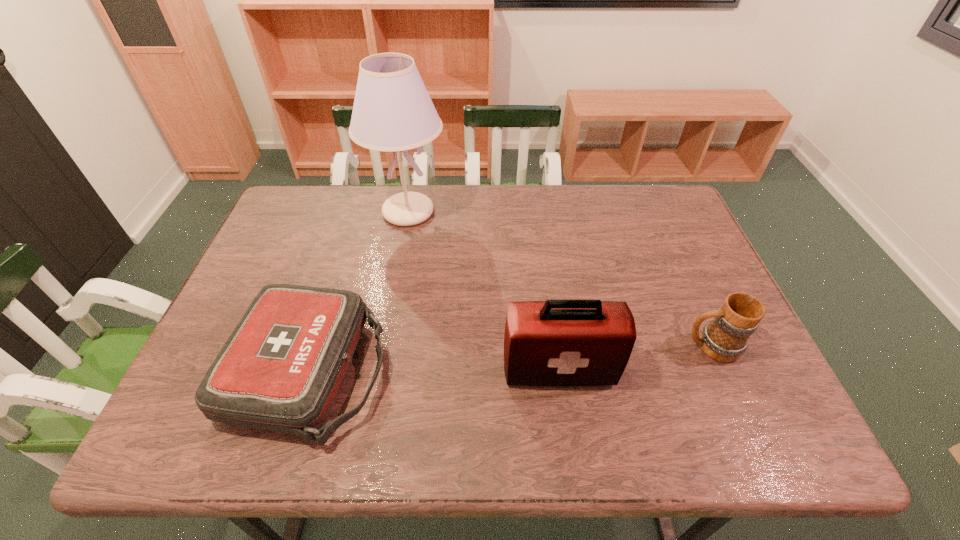
Find the location of a particular element. The height and width of the screenshot is (540, 960). the farthest object is located at coordinates coord(392,112).

At what (x,y) coordinates should I click in order to perform the action: click on the tallest object. Please return your answer as a coordinate pair (x, y). The image size is (960, 540). Looking at the image, I should click on (392, 112).

Locate an element on the screen. the taller first-aid kit is located at coordinates [556, 342].

Where is `the second object from right to left`? The width and height of the screenshot is (960, 540). the second object from right to left is located at coordinates (556, 342).

Where is `the third tallest object`? The image size is (960, 540). the third tallest object is located at coordinates (725, 338).

Where is `mug`? The image size is (960, 540). mug is located at coordinates (725, 338).

At what (x,y) coordinates should I click in order to perform the action: click on the shortest object. Please return your answer as a coordinate pair (x, y). Looking at the image, I should click on (280, 370).

This screenshot has height=540, width=960. Identify the location of the left first-aid kit. (280, 370).

At what (x,y) coordinates should I click in order to perform the action: click on free space located on the right of the lampshade. Please return your answer as a coordinate pair (x, y). The image size is (960, 540). Looking at the image, I should click on (542, 212).

At what (x,y) coordinates should I click in order to perform the action: click on free space located on the side of the right first-aid kit with the cross symbol. Please return your answer as a coordinate pair (x, y). This screenshot has height=540, width=960. Looking at the image, I should click on (564, 411).